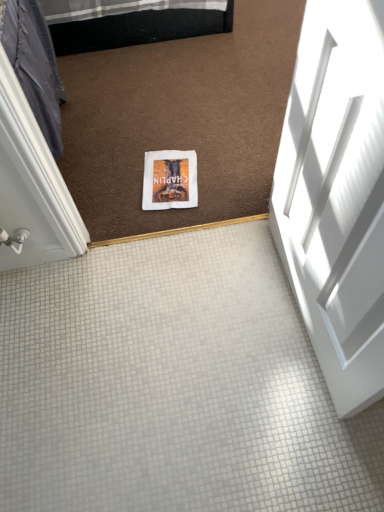
Question: Is white paper at center taller than white glossy door at right?

Choices:
 (A) yes
 (B) no

Answer: (B)

Question: Is white paper at center looking in the opposite direction of white glossy door at right?

Choices:
 (A) yes
 (B) no

Answer: (B)

Question: Are white paper at center and white glossy door at right making contact?

Choices:
 (A) no
 (B) yes

Answer: (A)

Question: Is white paper at center positioned behind white glossy door at right?

Choices:
 (A) yes
 (B) no

Answer: (A)

Question: Are white paper at center and white glossy door at right located far from each other?

Choices:
 (A) yes
 (B) no

Answer: (B)

Question: From the image's perspective, is white paper at center on white glossy door at right?

Choices:
 (A) no
 (B) yes

Answer: (B)

Question: Would you say white glossy door at right contains white paper at center?

Choices:
 (A) yes
 (B) no

Answer: (B)

Question: From the image's perspective, is white glossy door at right under white paper at center?

Choices:
 (A) no
 (B) yes

Answer: (B)

Question: Is white glossy door at right not close to white paper at center?

Choices:
 (A) no
 (B) yes

Answer: (A)

Question: Is white glossy door at right located outside white paper at center?

Choices:
 (A) no
 (B) yes

Answer: (B)

Question: Does white glossy door at right appear on the right side of white paper at center?

Choices:
 (A) no
 (B) yes

Answer: (B)

Question: Does white glossy door at right have a lesser width compared to white paper at center?

Choices:
 (A) no
 (B) yes

Answer: (B)

Question: From the image's perspective, is white paper at center above or below white glossy door at right?

Choices:
 (A) above
 (B) below

Answer: (A)